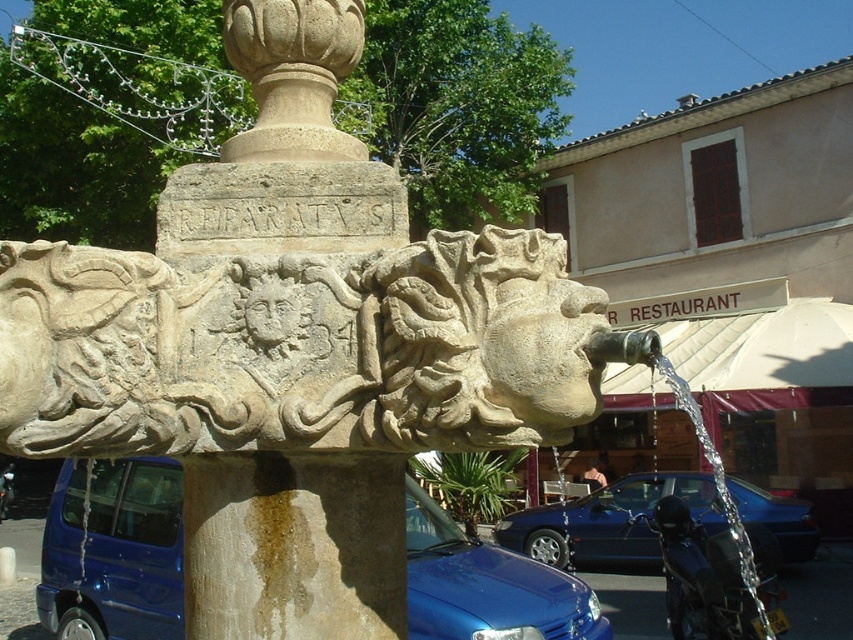
Does blue glossy car at center have a larger size compared to clear liquid water at center right?

Actually, blue glossy car at center might be smaller than clear liquid water at center right.

Which is behind, point (798, 516) or point (706, 435)?

Point (706, 435)

Between point (622, 528) and point (746, 584), which one is positioned in front?

Positioned in front is point (746, 584).

Identify the location of blue glossy car at center. (608, 520).

Which is below, metallic blue car at center or clear liquid water at center right?

Positioned lower is metallic blue car at center.

In the scene shown: Who is more forward, (531,605) or (743,552)?

Positioned in front is point (743,552).

The width and height of the screenshot is (853, 640). What are the coordinates of `metallic blue car at center` in the screenshot? It's located at (114, 552).

Does metallic blue car at center appear over blue glossy car at center?

Correct, metallic blue car at center is located above blue glossy car at center.

Can you confirm if metallic blue car at center is shorter than blue glossy car at center?

In fact, metallic blue car at center may be taller than blue glossy car at center.

Identify the location of metallic blue car at center. This screenshot has height=640, width=853. (114, 552).